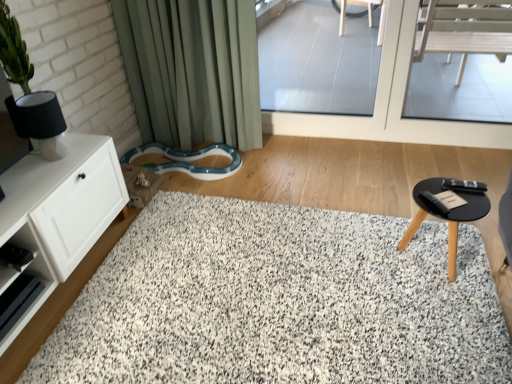
Question: Is transparent glass window at center, arranged as the 2th window screen when viewed from the left, situated inside white matte cabinet at left or outside?

Choices:
 (A) inside
 (B) outside

Answer: (B)

Question: From a real-world perspective, is transparent glass window at center, which appears as the first window screen when viewed from the right, physically located above or below white matte cabinet at left?

Choices:
 (A) above
 (B) below

Answer: (A)

Question: Estimate the real-world distances between objects in this image. Which object is farther from the white matte cabinet at left?

Choices:
 (A) green fabric curtain at upper left
 (B) transparent glass door at upper center, which appears as the 1th window screen when viewed from the left
 (C) transparent glass window at center, which appears as the first window screen when viewed from the right
 (D) white shaggy rug at center
 (E) black matte lampshade at upper left

Answer: (B)

Question: Which object is the farthest from the transparent glass window at center, arranged as the 2th window screen when viewed from the left?

Choices:
 (A) green fabric curtain at upper left
 (B) transparent glass door at upper center, which appears as the 1th window screen when viewed from the left
 (C) white shaggy rug at center
 (D) white matte cabinet at left
 (E) black matte lampshade at upper left

Answer: (E)